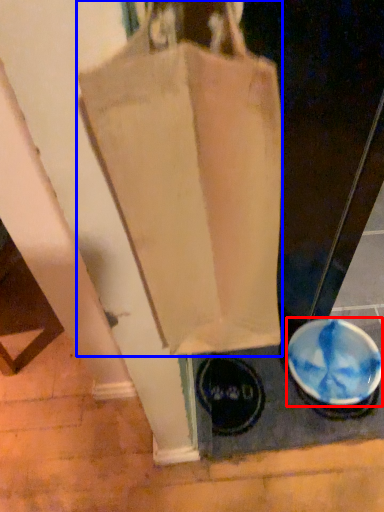
Question: Which object appears farthest to the camera in this image, bowl (highlighted by a red box) or handbag (highlighted by a blue box)?

Choices:
 (A) bowl
 (B) handbag

Answer: (A)